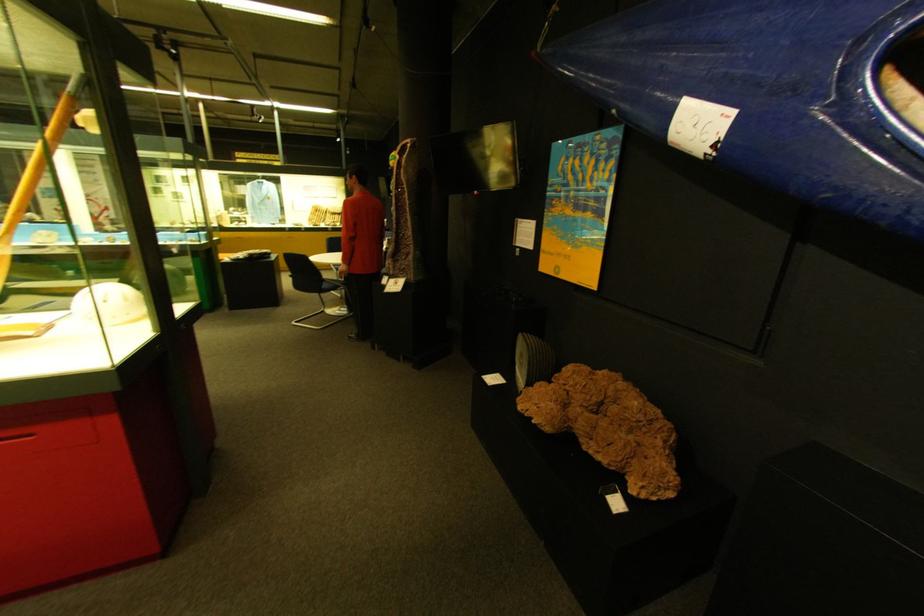
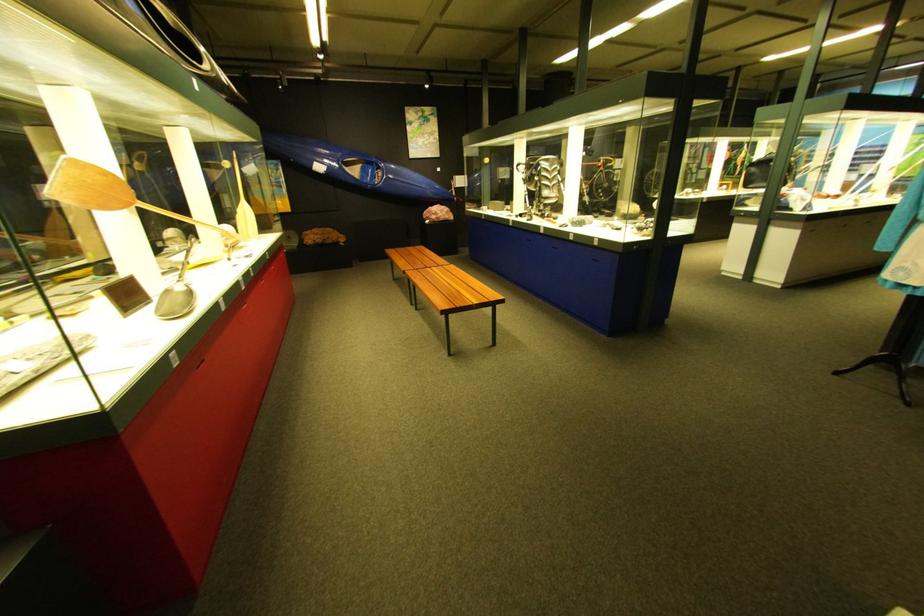
Where in the second image is the point corresponding to point (748, 114) from the first image?

(342, 169)